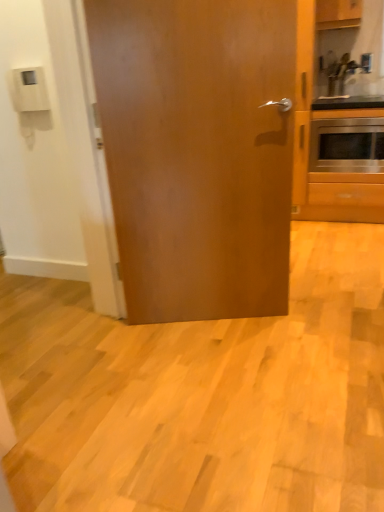
Question: From a real-world perspective, relative to wooden cabinet at upper right, is metallic silver sink at upper right vertically above or below?

Choices:
 (A) above
 (B) below

Answer: (B)

Question: Would you say metallic silver sink at upper right is to the left or to the right of wooden cabinet at upper right in the picture?

Choices:
 (A) left
 (B) right

Answer: (B)

Question: Which object is the closest to the wooden cabinet at upper right?

Choices:
 (A) glossy wood door at center
 (B) stainless steel oven at right
 (C) metallic silver sink at upper right

Answer: (C)

Question: Which is farther from the glossy wood door at center?

Choices:
 (A) stainless steel oven at right
 (B) wooden cabinet at upper right
 (C) metallic silver sink at upper right

Answer: (B)